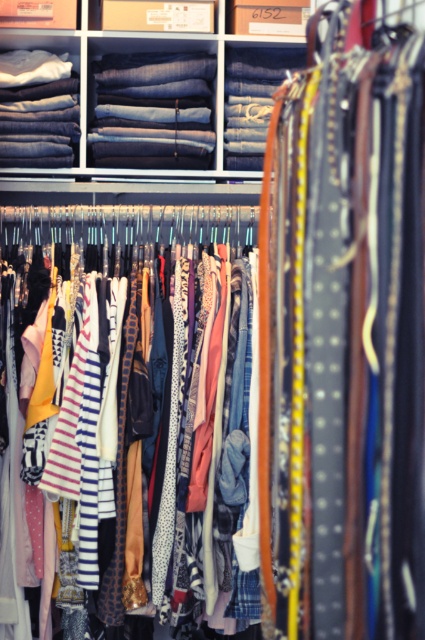
You are trying to decide whether to wear the printed fabric dress at center or the denim jeans at upper center. If you want to wear something wider, which should you choose?

The printed fabric dress at center is wider than the denim jeans at upper center, so you should choose the printed fabric dress at center.

You are organizing a clothing store and need to place two pairs of jeans in the display. The denim fabric jeans at upper center and the denim jeans at upper center. Which pair should you place in the larger size section?

The denim fabric jeans at upper center should be placed in the larger size section because it has a larger size compared to the denim jeans at upper center.